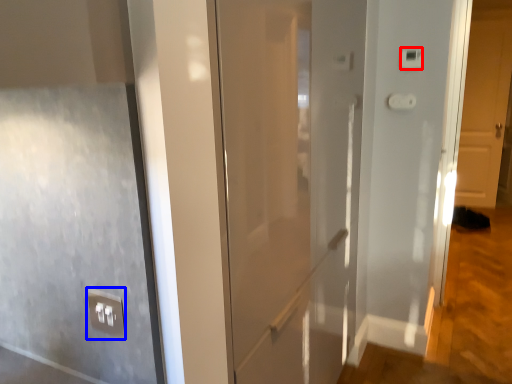
Question: Which point is further to the camera, light switch (highlighted by a red box) or electric outlet (highlighted by a blue box)?

Choices:
 (A) light switch
 (B) electric outlet

Answer: (A)